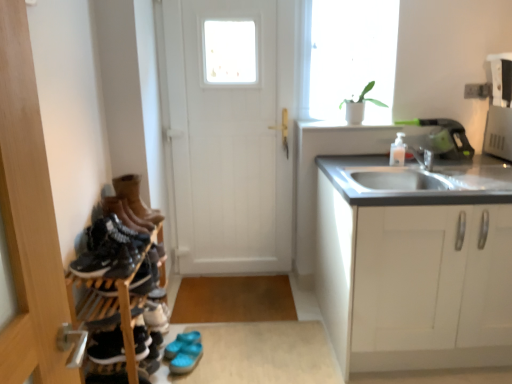
Question: Can you confirm if white matte door at center is wider than blue rubber sandals at lower center, which is counted as the first footwear, starting from the bottom?

Choices:
 (A) no
 (B) yes

Answer: (A)

Question: Can you confirm if white matte door at center is shorter than blue rubber sandals at lower center, the 4th footwear viewed from the top?

Choices:
 (A) yes
 (B) no

Answer: (B)

Question: Can you confirm if white matte door at center is bigger than blue rubber sandals at lower center, the 1th footwear in the back-to-front sequence?

Choices:
 (A) no
 (B) yes

Answer: (B)

Question: Considering the relative sizes of white matte door at center and blue rubber sandals at lower center, the 4th footwear viewed from the top, in the image provided, is white matte door at center taller than blue rubber sandals at lower center, the 4th footwear viewed from the top,?

Choices:
 (A) no
 (B) yes

Answer: (B)

Question: Is white matte door at center next to blue rubber sandals at lower center, the 1th footwear in the back-to-front sequence, and touching it?

Choices:
 (A) no
 (B) yes

Answer: (A)

Question: Can you confirm if white matte door at center is positioned to the left of blue rubber sandals at lower center, the 1th footwear in the back-to-front sequence?

Choices:
 (A) yes
 (B) no

Answer: (B)

Question: From a real-world perspective, is black matte shoe at left, the 3th shoe ordered from the bottom, located higher than black suede sneakers at lower left, the fourth footwear when ordered from back to front?

Choices:
 (A) yes
 (B) no

Answer: (A)

Question: Does black matte shoe at left, the 3th shoe ordered from the bottom, have a lesser width compared to black suede sneakers at lower left, placed as the 3th footwear when sorted from top to bottom?

Choices:
 (A) yes
 (B) no

Answer: (A)

Question: Can you confirm if black matte shoe at left, the 1th shoe viewed from the top, is wider than black suede sneakers at lower left, the fourth footwear when ordered from back to front?

Choices:
 (A) yes
 (B) no

Answer: (B)

Question: Is black matte shoe at left, the 3th shoe ordered from the bottom, shorter than black suede sneakers at lower left, placed as the 3th footwear when sorted from top to bottom?

Choices:
 (A) no
 (B) yes

Answer: (A)

Question: Does black matte shoe at left, the 1th shoe viewed from the top, have a greater height compared to black suede sneakers at lower left, the 1th footwear positioned from the front?

Choices:
 (A) yes
 (B) no

Answer: (A)

Question: Is the depth of black matte shoe at left, which is the third shoe from back to front, less than that of black suede sneakers at lower left, which is the second footwear from bottom to top?

Choices:
 (A) no
 (B) yes

Answer: (B)

Question: Considering the relative sizes of matte black sneaker at left, which is the 3th shoe from front to back, and wooden shoe rack at left in the image provided, is matte black sneaker at left, which is the 3th shoe from front to back, shorter than wooden shoe rack at left?

Choices:
 (A) yes
 (B) no

Answer: (A)